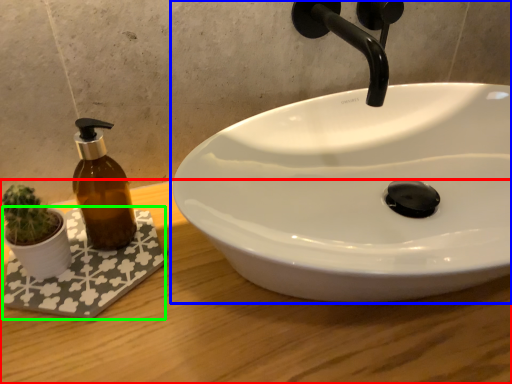
Question: Which object is the farthest from counter top (highlighted by a red box)? Choose among these: sink (highlighted by a blue box) or bath mat (highlighted by a green box).

Choices:
 (A) sink
 (B) bath mat

Answer: (A)